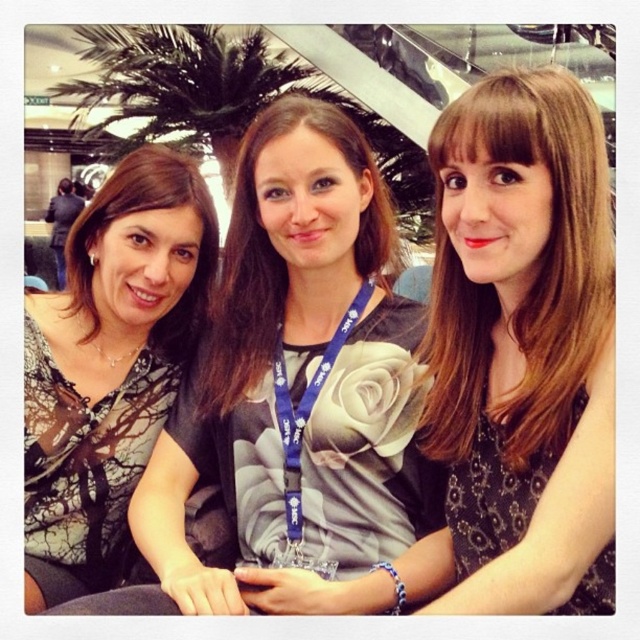
You are standing in front of the matte gray dress at center and want to take a selfie with it. If your phone can capture a clear image up to 10 feet away, will you be able to take a clear photo of the dress without moving closer?

The matte gray dress at center and viewer are 9.24 feet apart from each other. Since your phone can capture up to 10 feet, you can take a clear photo without moving closer.

Where is the matte black shirt at left located in the image?

The matte black shirt at left is located at point [109,364].

Looking at this image, you are a photographer trying to capture a clear shot of the matte gray dress at center and the blue fabric lanyard at center. Based on their distance, will the focus be sharp on both objects if you set the camera to a depth of field that can sharply focus objects within 14 inches?

The matte gray dress at center is 14.36 inches away from the blue fabric lanyard at center. Since the depth of field can only sharply focus objects within 14 inches, the distance between them exceeds this limit. Therefore, both objects cannot be in sharp focus simultaneously.